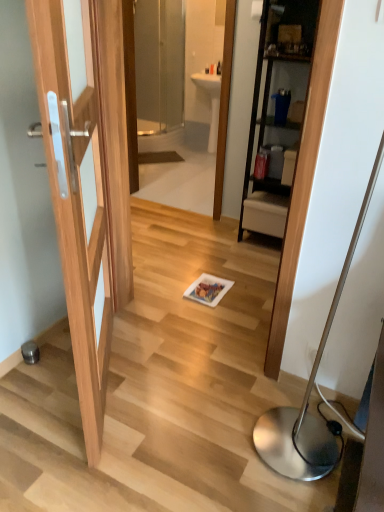
Question: Can you confirm if silver metallic floor lamp at lower right is taller than transparent glass screen door at upper center?

Choices:
 (A) no
 (B) yes

Answer: (B)

Question: Does silver metallic floor lamp at lower right have a lesser width compared to transparent glass screen door at upper center?

Choices:
 (A) yes
 (B) no

Answer: (A)

Question: Could you tell me if silver metallic floor lamp at lower right is facing transparent glass screen door at upper center?

Choices:
 (A) no
 (B) yes

Answer: (A)

Question: From a real-world perspective, is silver metallic floor lamp at lower right below transparent glass screen door at upper center?

Choices:
 (A) yes
 (B) no

Answer: (A)

Question: Is silver metallic floor lamp at lower right at the left side of transparent glass screen door at upper center?

Choices:
 (A) no
 (B) yes

Answer: (A)

Question: Is silver metallic floor lamp at lower right further to the viewer compared to transparent glass screen door at upper center?

Choices:
 (A) yes
 (B) no

Answer: (B)

Question: Would you consider transparent glass screen door at upper center to be distant from transparent glass mirror at upper center?

Choices:
 (A) yes
 (B) no

Answer: (B)

Question: Is transparent glass screen door at upper center oriented away from transparent glass mirror at upper center?

Choices:
 (A) no
 (B) yes

Answer: (A)

Question: Does transparent glass screen door at upper center turn towards transparent glass mirror at upper center?

Choices:
 (A) no
 (B) yes

Answer: (A)

Question: Is transparent glass screen door at upper center completely or partially outside of transparent glass mirror at upper center?

Choices:
 (A) yes
 (B) no

Answer: (A)

Question: Considering the relative sizes of transparent glass screen door at upper center and transparent glass mirror at upper center in the image provided, is transparent glass screen door at upper center shorter than transparent glass mirror at upper center?

Choices:
 (A) no
 (B) yes

Answer: (B)

Question: Is transparent glass screen door at upper center positioned behind transparent glass mirror at upper center?

Choices:
 (A) yes
 (B) no

Answer: (A)

Question: Is transparent glass mirror at upper center facing away from silver metallic floor lamp at lower right?

Choices:
 (A) yes
 (B) no

Answer: (B)